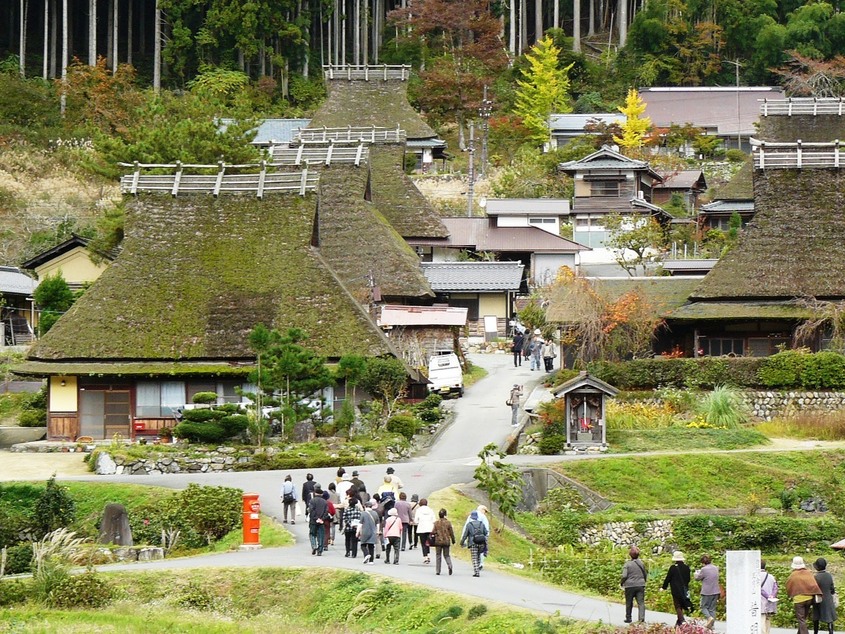
Find the location of `door`. door is located at coordinates (89, 415).